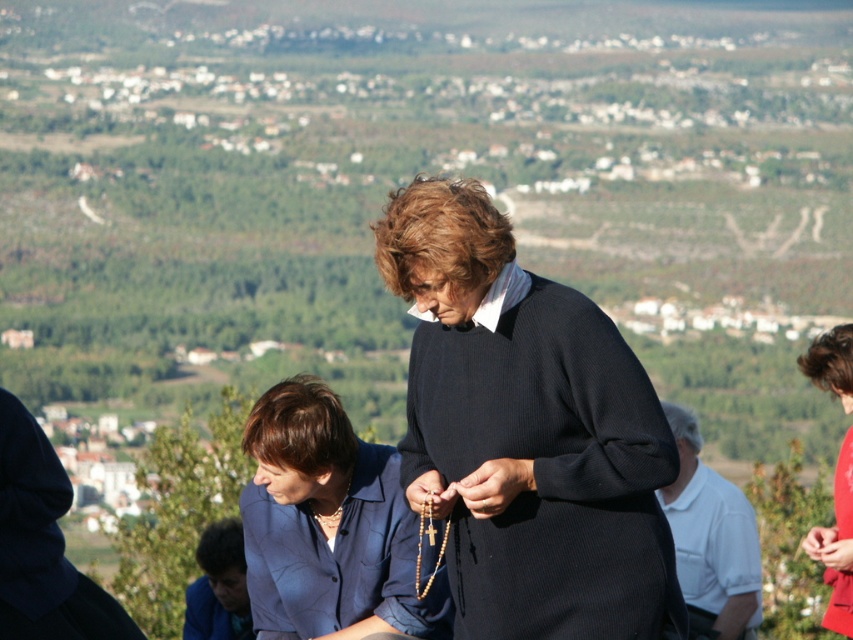
Question: Is dark blue woolen robe at lower left smaller than blue fabric robe at lower left?

Choices:
 (A) no
 (B) yes

Answer: (A)

Question: Where is matte red coat at center located in relation to blue fabric robe at lower left in the image?

Choices:
 (A) below
 (B) above

Answer: (B)

Question: Which point is farther to the camera?

Choices:
 (A) pos(703,516)
 (B) pos(61,477)
 (C) pos(404,620)

Answer: (A)

Question: Considering the real-world distances, which object is farthest from the blue fabric blouse at lower center?

Choices:
 (A) white cotton shirt at right
 (B) dark blue woolen robe at lower left

Answer: (A)

Question: Does blue fabric blouse at lower center have a larger size compared to dark blue woolen robe at lower left?

Choices:
 (A) no
 (B) yes

Answer: (B)

Question: Which object is closer to the camera taking this photo?

Choices:
 (A) red matte dress at lower right
 (B) white cotton shirt at right
 (C) dark blue woolen robe at lower left

Answer: (B)